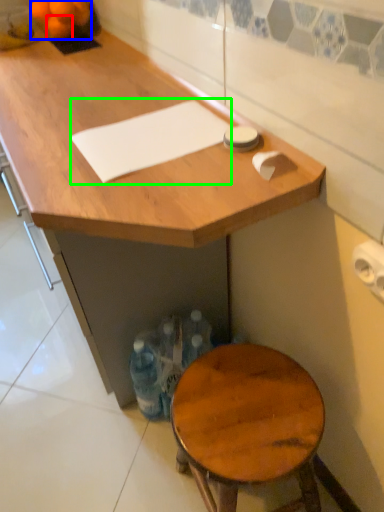
Question: Which object is positioned farthest from tangerine (highlighted by a red box)? Select from tangerine (highlighted by a blue box) and notepad (highlighted by a green box).

Choices:
 (A) tangerine
 (B) notepad

Answer: (B)